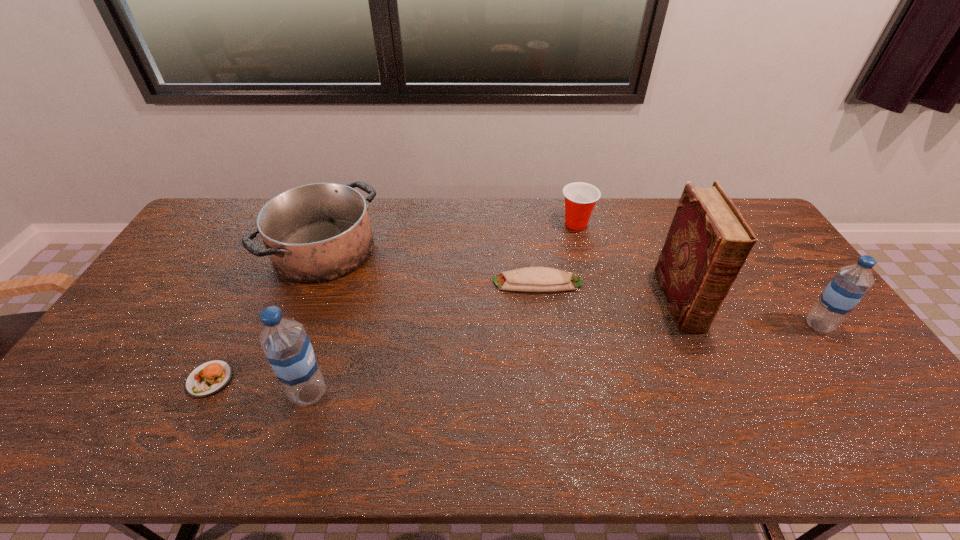
I want to click on free space that is in between the farther water bottle and the patty, so click(515, 352).

The height and width of the screenshot is (540, 960). Identify the location of free area in between the burrito and the hardback book. pyautogui.click(x=609, y=292).

I want to click on free area in between the third shortest object and the patty, so pos(393,301).

You are a GUI agent. You are given a task and a screenshot of the screen. Output one action in this format:
    pyautogui.click(x=<x>, y=<y>)
    Task: Click on the unoccupied area between the third shortest object and the fourth tallest object
    The width and height of the screenshot is (960, 540).
    Given the screenshot: What is the action you would take?
    pyautogui.click(x=450, y=237)

I want to click on vacant space that is in between the burrito and the sixth object from left to right, so click(x=609, y=292).

At what (x,y) coordinates should I click in order to perform the action: click on vacant area between the patty and the fifth shortest object. Please return your answer as a coordinate pair (x, y). The height and width of the screenshot is (540, 960). Looking at the image, I should click on (515, 352).

This screenshot has width=960, height=540. Find the location of `object that is the closest to the burrito`. object that is the closest to the burrito is located at coordinates (580, 198).

Where is `object that is the third nearest to the patty`? object that is the third nearest to the patty is located at coordinates (530, 279).

Identify the location of blank space that satisfies the following two spatial constraints: 1. on the spine side of the hardback book; 2. on the label of the nearer water bottle. (722, 393).

This screenshot has width=960, height=540. What are the coordinates of `vacant area in the image that satisfies the following two spatial constraints: 1. on the spine side of the hardback book; 2. on the label of the left water bottle` in the screenshot? It's located at (722, 393).